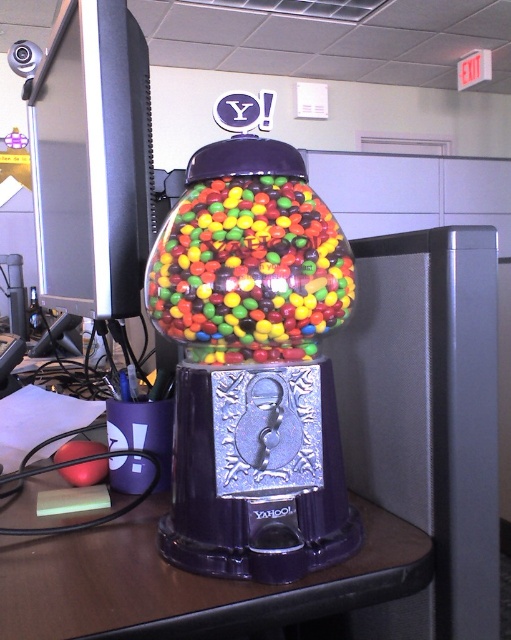
You are organizing a desk in an office and need to place a new item between the purple glossy table at center and the shiny multicolored gumballs at center. Where should you place it to ensure it is closer to the gumballs than the table?

Place the new item closer to the shiny multicolored gumballs at center. Since the purple glossy table at center is to the left of the shiny multicolored gumballs at center, positioning the item near the gumballs ensures it is closer to them than the table.

You are organizing a desk and need to place a new item between the purple glossy table at center and the shiny multicolored gumballs at center. Given their sizes, which object should you place closer to the edge of the desk to ensure there is enough space?

The shiny multicolored gumballs at center should be placed closer to the edge since the purple glossy table at center is wider, requiring more space in the center.